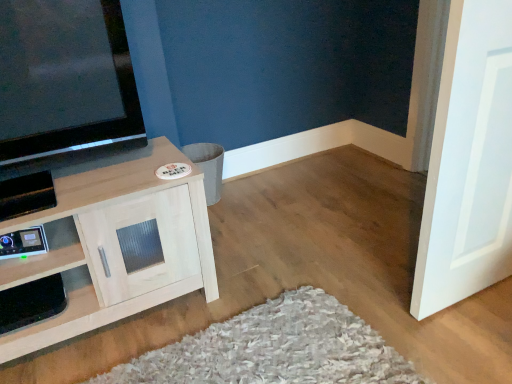
Question: Can you confirm if white matte door at right is wider than light wood cabinet at left?

Choices:
 (A) yes
 (B) no

Answer: (B)

Question: Is white matte door at right placed right next to light wood cabinet at left?

Choices:
 (A) yes
 (B) no

Answer: (B)

Question: Is white matte door at right to the right of light wood cabinet at left from the viewer's perspective?

Choices:
 (A) yes
 (B) no

Answer: (A)

Question: Is white matte door at right aimed at light wood cabinet at left?

Choices:
 (A) yes
 (B) no

Answer: (B)

Question: Does white matte door at right have a larger size compared to light wood cabinet at left?

Choices:
 (A) no
 (B) yes

Answer: (A)

Question: Is white matte door at right positioned in front of light wood cabinet at left?

Choices:
 (A) yes
 (B) no

Answer: (A)

Question: Does light wood cabinet at left lie behind white matte door at right?

Choices:
 (A) no
 (B) yes

Answer: (B)

Question: Can you confirm if light wood cabinet at left is taller than white matte door at right?

Choices:
 (A) yes
 (B) no

Answer: (B)

Question: Is light wood cabinet at left in front of white matte door at right?

Choices:
 (A) no
 (B) yes

Answer: (A)

Question: Does light wood cabinet at left have a smaller size compared to white matte door at right?

Choices:
 (A) yes
 (B) no

Answer: (B)

Question: Would you say light wood cabinet at left is a long distance from white matte door at right?

Choices:
 (A) no
 (B) yes

Answer: (A)

Question: Could you tell me if light wood cabinet at left is facing white matte door at right?

Choices:
 (A) no
 (B) yes

Answer: (A)

Question: Is light wood cabinet at left to the left or to the right of white matte door at right in the image?

Choices:
 (A) left
 (B) right

Answer: (A)